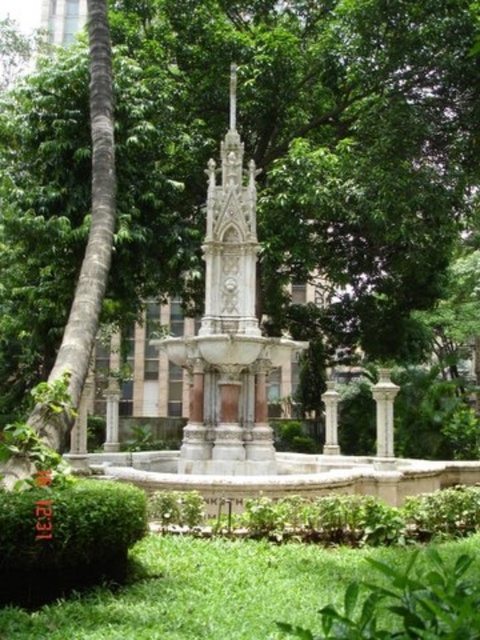
Question: Does white marble column at lower right have a greater width compared to white stone column at center?

Choices:
 (A) yes
 (B) no

Answer: (A)

Question: Is white marble column at lower right smaller than white stone column at center?

Choices:
 (A) no
 (B) yes

Answer: (A)

Question: Is white marble column at lower right positioned in front of white stone column at center?

Choices:
 (A) no
 (B) yes

Answer: (B)

Question: Which point is farther from the camera taking this photo?

Choices:
 (A) (324, 404)
 (B) (384, 436)

Answer: (A)